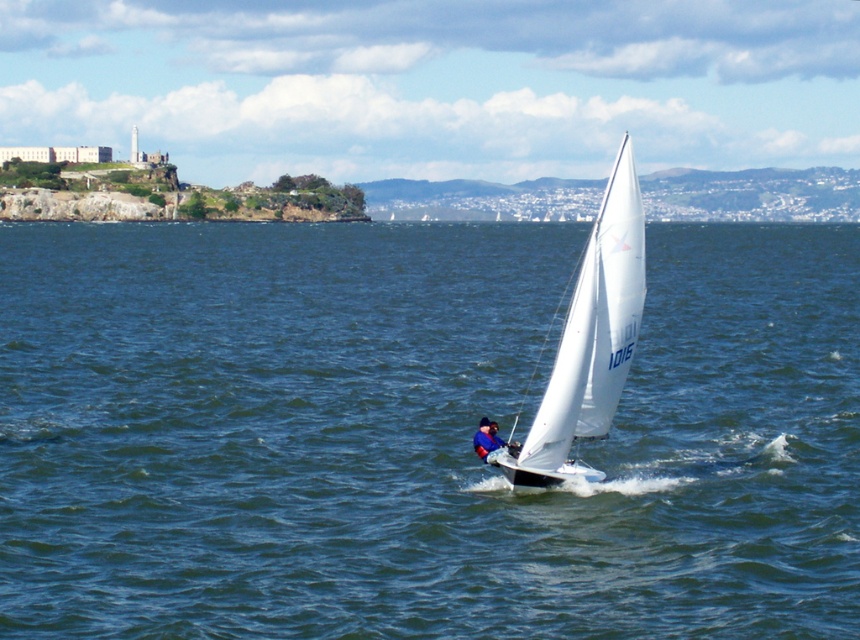
You are a sailor trying to determine which boat is higher above the water. You see the white sailboat at center and the blue fabric sailboat at center. Which one has a higher position?

The white sailboat at center is taller than the blue fabric sailboat at center, so the white sailboat at center has a higher position above the water.

You are a sailor navigating a boat and see the point marked at coordinates [416,435]. Based on the scene description, what type of terrain is located at those coordinates?

The point at coordinates [416,435] is on blue water at center, so the terrain there is water.